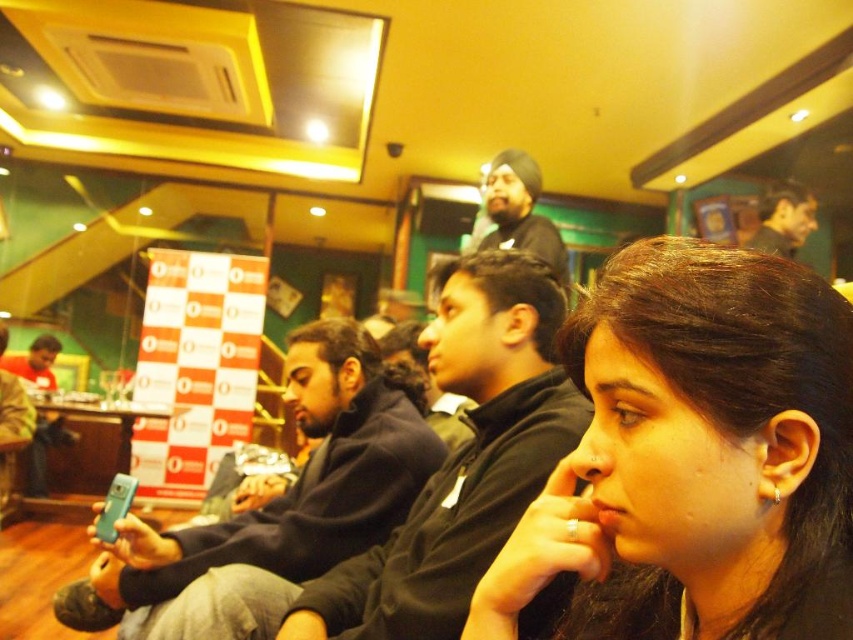
Question: Which point is closer to the camera?

Choices:
 (A) matte blue phone at center
 (B) dark brown hair at center
 (C) matte black turban at upper center

Answer: (B)

Question: Does dark blue sweater at center appear on the right side of matte black turban at upper center?

Choices:
 (A) yes
 (B) no

Answer: (B)

Question: In this image, where is dark blue sweater at center located relative to matte black turban at upper center?

Choices:
 (A) below
 (B) above

Answer: (A)

Question: Which point is farther to the camera?

Choices:
 (A) dark blue sweater at center
 (B) matte black turban at upper center

Answer: (B)

Question: Is dark blue sweater at center to the right of matte blue phone at center from the viewer's perspective?

Choices:
 (A) yes
 (B) no

Answer: (A)

Question: Which point appears farthest from the camera in this image?

Choices:
 (A) (807, 216)
 (B) (498, 182)

Answer: (A)